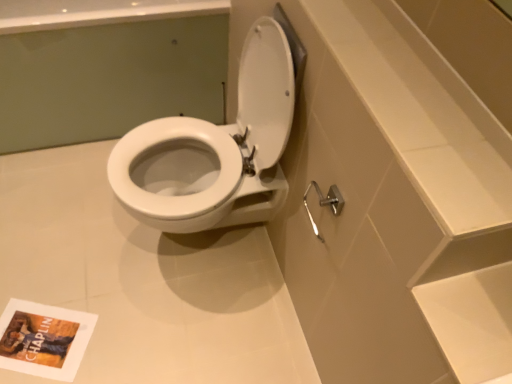
Question: Does satin nickel shower arm at lower right have a larger size compared to matte paper book cover at lower left?

Choices:
 (A) no
 (B) yes

Answer: (B)

Question: Does satin nickel shower arm at lower right have a lesser width compared to matte paper book cover at lower left?

Choices:
 (A) no
 (B) yes

Answer: (B)

Question: From the image's perspective, is satin nickel shower arm at lower right under matte paper book cover at lower left?

Choices:
 (A) yes
 (B) no

Answer: (B)

Question: Is satin nickel shower arm at lower right not inside matte paper book cover at lower left?

Choices:
 (A) no
 (B) yes

Answer: (B)

Question: Is the depth of satin nickel shower arm at lower right greater than that of matte paper book cover at lower left?

Choices:
 (A) no
 (B) yes

Answer: (A)

Question: From the image's perspective, does satin nickel shower arm at lower right appear higher than matte paper book cover at lower left?

Choices:
 (A) yes
 (B) no

Answer: (A)

Question: Is white glossy toilet at center oriented towards white glossy toilet at center?

Choices:
 (A) no
 (B) yes

Answer: (A)

Question: Does white glossy toilet at center have a smaller size compared to white glossy toilet at center?

Choices:
 (A) no
 (B) yes

Answer: (B)

Question: Does white glossy toilet at center have a greater height compared to white glossy toilet at center?

Choices:
 (A) yes
 (B) no

Answer: (B)

Question: From a real-world perspective, is white glossy toilet at center over white glossy toilet at center?

Choices:
 (A) yes
 (B) no

Answer: (B)

Question: From a real-world perspective, is white glossy toilet at center located beneath white glossy toilet at center?

Choices:
 (A) no
 (B) yes

Answer: (B)

Question: Considering the relative positions of white glossy toilet at center and white glossy toilet at center in the image provided, is white glossy toilet at center to the right of white glossy toilet at center from the viewer's perspective?

Choices:
 (A) yes
 (B) no

Answer: (A)

Question: Is there a large distance between satin nickel shower arm at lower right and white glossy toilet at center?

Choices:
 (A) no
 (B) yes

Answer: (A)